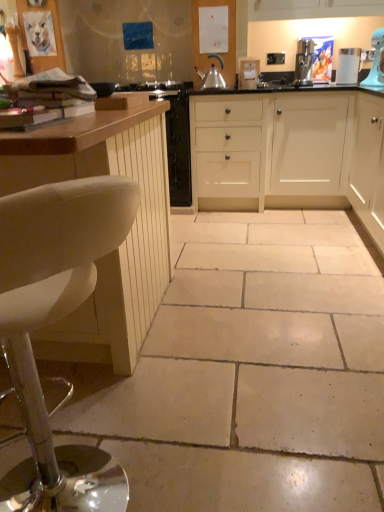
Question: In terms of width, does white matte cabinet at center, the second cabinetry when ordered from right to left, look wider or thinner when compared to white leather stool at left?

Choices:
 (A) thin
 (B) wide

Answer: (B)

Question: Choose the correct answer: Is white matte cabinet at center, marked as the 2th cabinetry in a left-to-right arrangement, inside white leather stool at left or outside it?

Choices:
 (A) inside
 (B) outside

Answer: (B)

Question: Estimate the real-world distances between objects in this image. Which object is closer to the white matte cabinet at right, the 3th cabinetry from the left?

Choices:
 (A) metallic stainless steel coffee maker at upper right, placed as the 1th kitchen appliance when sorted from right to left
 (B) satin silver kettle at center, which is counted as the first kitchen appliance, starting from the left
 (C) white matte cabinet at center, marked as the 2th cabinetry in a left-to-right arrangement
 (D) beige tile floor at center
 (E) blue plastic stand mixer at upper right

Answer: (C)

Question: Estimate the real-world distances between objects in this image. Which object is closer to the white wood cabinet at left, the 3th cabinetry when ordered from right to left?

Choices:
 (A) blue plastic stand mixer at upper right
 (B) white glossy coffee maker at upper right
 (C) metallic stainless steel coffee maker at upper right, placed as the 1th kitchen appliance when sorted from right to left
 (D) satin silver kettle at center, which is counted as the first kitchen appliance, starting from the left
 (E) white leather stool at left

Answer: (E)